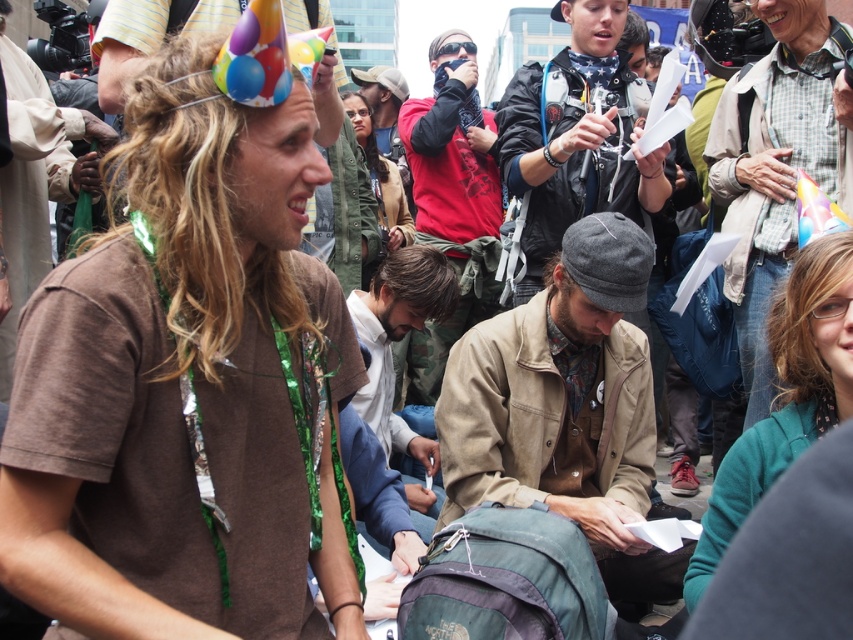
Question: Which of the following is the farthest from the observer?

Choices:
 (A) (711, 192)
 (B) (149, 634)

Answer: (A)

Question: Which point is farther to the camera?

Choices:
 (A) (786, 204)
 (B) (235, 467)
 (C) (555, 234)
 (D) (627, 515)

Answer: (C)

Question: In this image, where is brown matte t-shirt at upper left located relative to flannel shirt at center?

Choices:
 (A) below
 (B) above

Answer: (B)

Question: Is brown matte t-shirt at upper left bigger than plaid flannel shirt at upper right?

Choices:
 (A) yes
 (B) no

Answer: (A)

Question: Which object is closer to the camera taking this photo?

Choices:
 (A) flannel shirt at center
 (B) plaid flannel shirt at upper right

Answer: (A)

Question: Observing the image, what is the correct spatial positioning of flannel shirt at center in reference to plaid flannel shirt at upper right?

Choices:
 (A) above
 (B) below

Answer: (B)